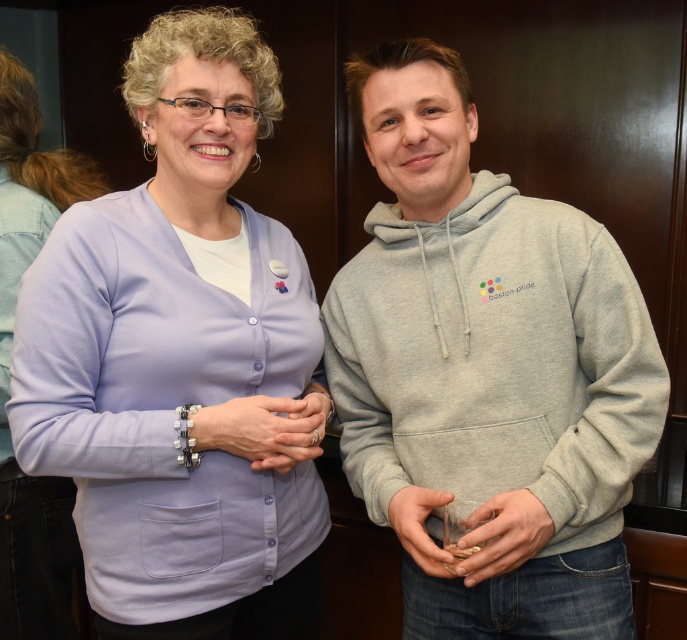
What are the coordinates of the lavender fabric cardigan at upper left?

The lavender fabric cardigan at upper left is located at coordinates point (179, 356).

Consider the image. You are at a social event and want to take a photo of both the point at position (210,378) and the point at position (45,168). Which point should you focus on first to ensure both are in focus?

You should focus on the point at position (210,378) first because it is closer to the viewer, so adjusting focus from near to far will help both points be in focus.